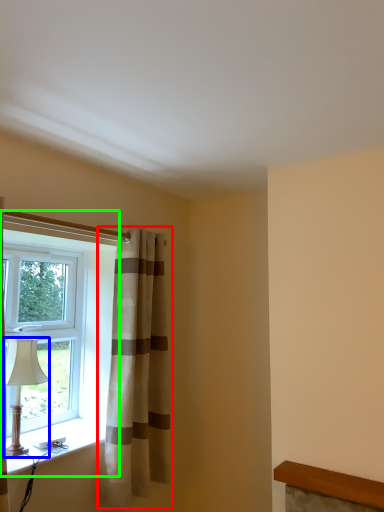
Question: Which is nearer to the curtain (highlighted by a red box)? table lamp (highlighted by a blue box) or window (highlighted by a green box).

Choices:
 (A) table lamp
 (B) window

Answer: (B)